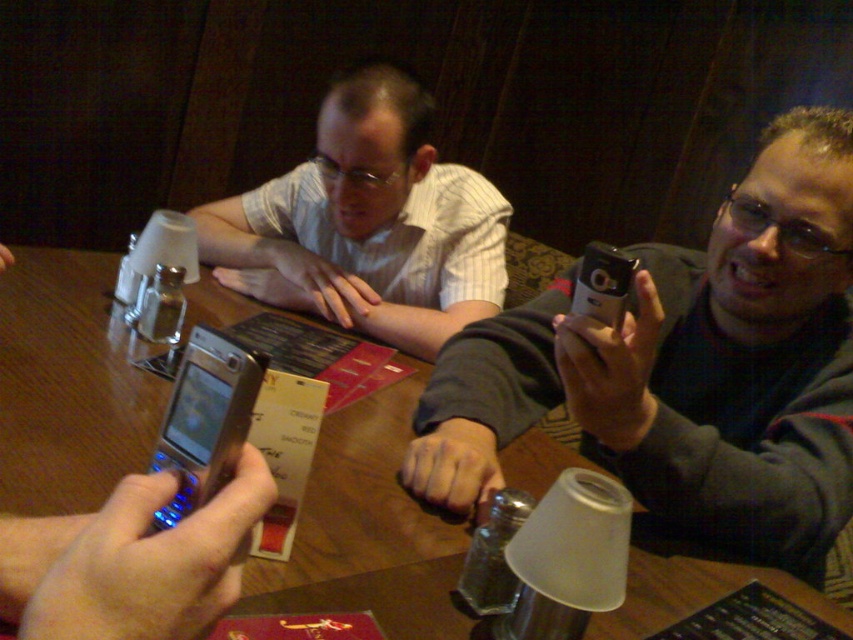
Consider the image. Can you confirm if wooden table at center is positioned above silver metallic phone at lower left?

Incorrect, wooden table at center is not positioned above silver metallic phone at lower left.

Based on the photo, does wooden table at center have a greater width compared to silver metallic phone at lower left?

Yes.

Where is `wooden table at center`? This screenshot has height=640, width=853. wooden table at center is located at coordinates (68, 385).

In order to click on wooden table at center in this screenshot , I will do [68, 385].

Which of these two, silver metallic phone at upper right or wooden table at center, stands taller?

With more height is silver metallic phone at upper right.

Between point (616, 388) and point (79, 476), which one is positioned behind?

Positioned behind is point (616, 388).

Is point (747, 464) closer to camera compared to point (281, 572)?

No, (747, 464) is further to viewer.

I want to click on silver metallic phone at upper right, so click(x=688, y=368).

Which is more to the left, wooden table at center or white striped shirt at upper center?

Positioned to the left is wooden table at center.

Does wooden table at center have a lesser width compared to white striped shirt at upper center?

Incorrect, wooden table at center's width is not less than white striped shirt at upper center's.

Is point (643, 586) positioned after point (370, 237)?

No, it is in front of (370, 237).

Identify the location of wooden table at center. (68, 385).